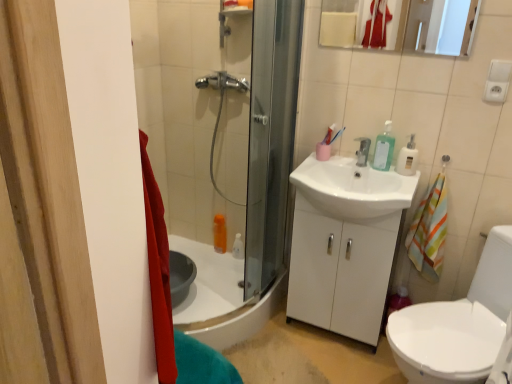
Question: Is white glossy sink at center shorter than matte white mirror at upper center?

Choices:
 (A) no
 (B) yes

Answer: (A)

Question: Is white glossy sink at center positioned behind matte white mirror at upper center?

Choices:
 (A) yes
 (B) no

Answer: (B)

Question: Considering the relative positions of white glossy sink at center and matte white mirror at upper center in the image provided, is white glossy sink at center to the right of matte white mirror at upper center from the viewer's perspective?

Choices:
 (A) yes
 (B) no

Answer: (B)

Question: Are white glossy sink at center and matte white mirror at upper center far apart?

Choices:
 (A) no
 (B) yes

Answer: (A)

Question: Could you tell me if white glossy sink at center is facing matte white mirror at upper center?

Choices:
 (A) no
 (B) yes

Answer: (A)

Question: Is silver metallic faucet at center bigger or smaller than matte white mirror at upper center?

Choices:
 (A) small
 (B) big

Answer: (B)

Question: Considering their positions, is silver metallic faucet at center located in front of or behind matte white mirror at upper center?

Choices:
 (A) front
 (B) behind

Answer: (B)

Question: Is silver metallic faucet at center wider or thinner than matte white mirror at upper center?

Choices:
 (A) wide
 (B) thin

Answer: (A)

Question: Does point (360, 160) appear closer or farther from the camera than point (473, 1)?

Choices:
 (A) closer
 (B) farther

Answer: (B)

Question: Is white glossy sink at center inside the boundaries of silver metallic faucet at center, or outside?

Choices:
 (A) inside
 (B) outside

Answer: (B)

Question: Relative to silver metallic faucet at center, is white glossy sink at center in front or behind?

Choices:
 (A) front
 (B) behind

Answer: (A)

Question: Based on their sizes in the image, would you say white glossy sink at center is bigger or smaller than silver metallic faucet at center?

Choices:
 (A) big
 (B) small

Answer: (A)

Question: From a real-world perspective, is white glossy sink at center physically located above or below silver metallic faucet at center?

Choices:
 (A) above
 (B) below

Answer: (B)

Question: Considering the positions of clear plastic soap dispenser at upper right and matte white mirror at upper center in the image, is clear plastic soap dispenser at upper right taller or shorter than matte white mirror at upper center?

Choices:
 (A) tall
 (B) short

Answer: (B)

Question: From a real-world perspective, relative to matte white mirror at upper center, is clear plastic soap dispenser at upper right vertically above or below?

Choices:
 (A) below
 (B) above

Answer: (A)